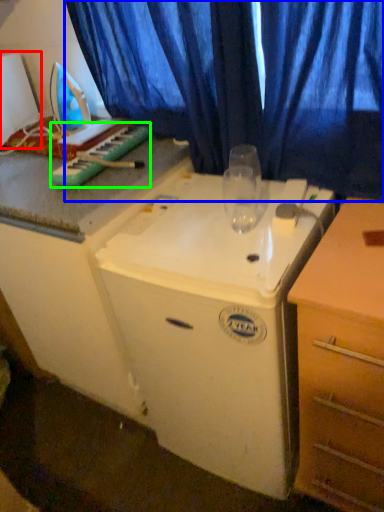
Question: Which object is the closest to the appliance (highlighted by a red box)? Choose among these: curtain (highlighted by a blue box) or musical keyboard (highlighted by a green box).

Choices:
 (A) curtain
 (B) musical keyboard

Answer: (B)